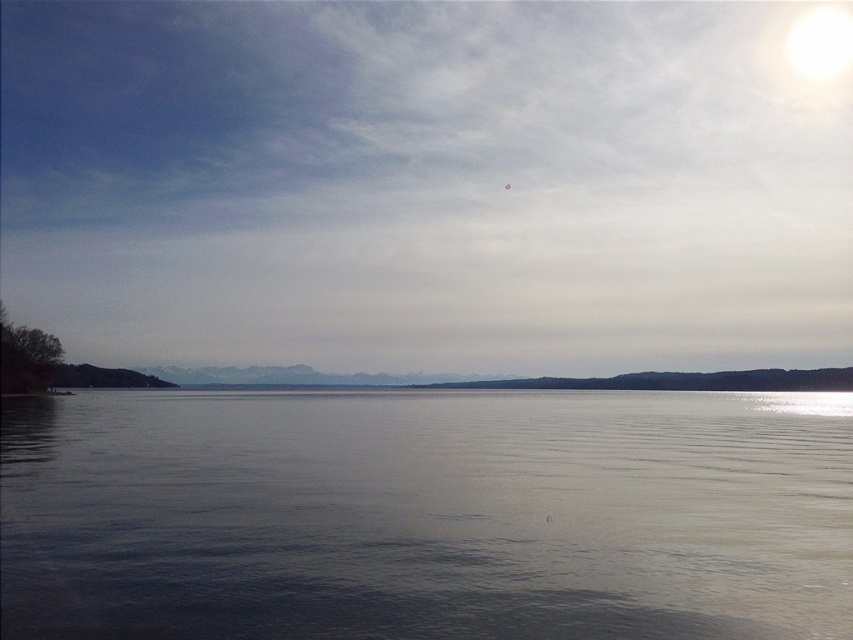
Is matte white sky at upper center to the right of smooth gray water at center from the viewer's perspective?

Incorrect, matte white sky at upper center is not on the right side of smooth gray water at center.

Where is `matte white sky at upper center`? Image resolution: width=853 pixels, height=640 pixels. matte white sky at upper center is located at coordinates (424, 184).

Is point (294, 214) farther from camera compared to point (612, 440)?

Yes, it is.

Locate an element on the screen. The height and width of the screenshot is (640, 853). matte white sky at upper center is located at coordinates (424, 184).